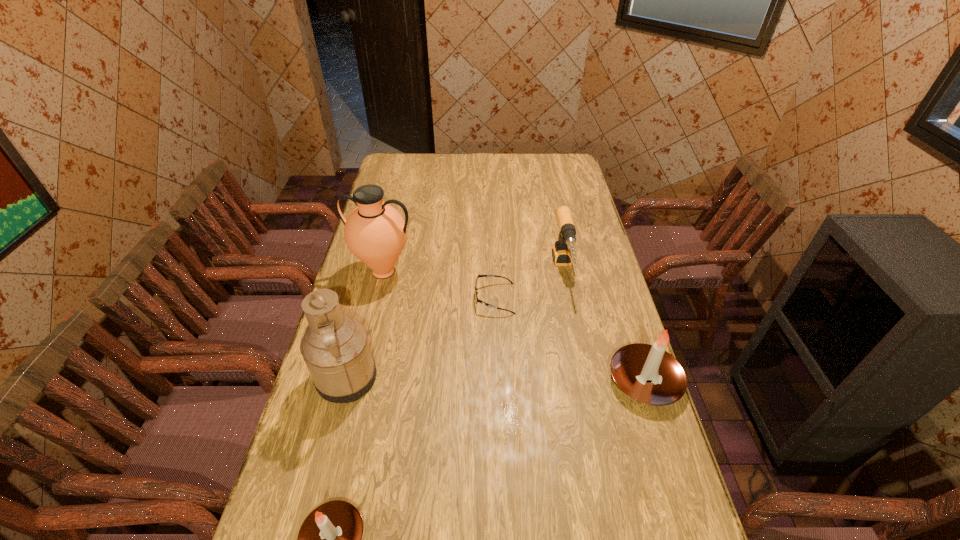
Identify which object is the third nearest to the nearest object. Please provide its 2D coordinates. Your answer should be formatted as a tuple, i.e. [(x, y)], where the tuple contains the x and y coordinates of a point satisfying the conditions above.

[(647, 373)]

Identify the location of the third closest object to the fourth object from left to right. Image resolution: width=960 pixels, height=540 pixels. (647, 373).

The image size is (960, 540). Identify the location of free region that satisfies the following two spatial constraints: 1. on the front-facing side of the sunglasses; 2. on the right side of the farther candle. (497, 381).

I want to click on free space that satisfies the following two spatial constraints: 1. on the handle side of the drill; 2. on the left side of the fourth shortest object, so click(x=587, y=381).

Where is `vacant position in the image that satisfies the following two spatial constraints: 1. on the front-facing side of the shortest object; 2. on the left side of the taller candle`? This screenshot has width=960, height=540. vacant position in the image that satisfies the following two spatial constraints: 1. on the front-facing side of the shortest object; 2. on the left side of the taller candle is located at coordinates (497, 381).

Where is `free space that satisfies the following two spatial constraints: 1. on the handle side of the second object from right to left; 2. on the front-facing side of the shortest object`? Image resolution: width=960 pixels, height=540 pixels. free space that satisfies the following two spatial constraints: 1. on the handle side of the second object from right to left; 2. on the front-facing side of the shortest object is located at coordinates (569, 298).